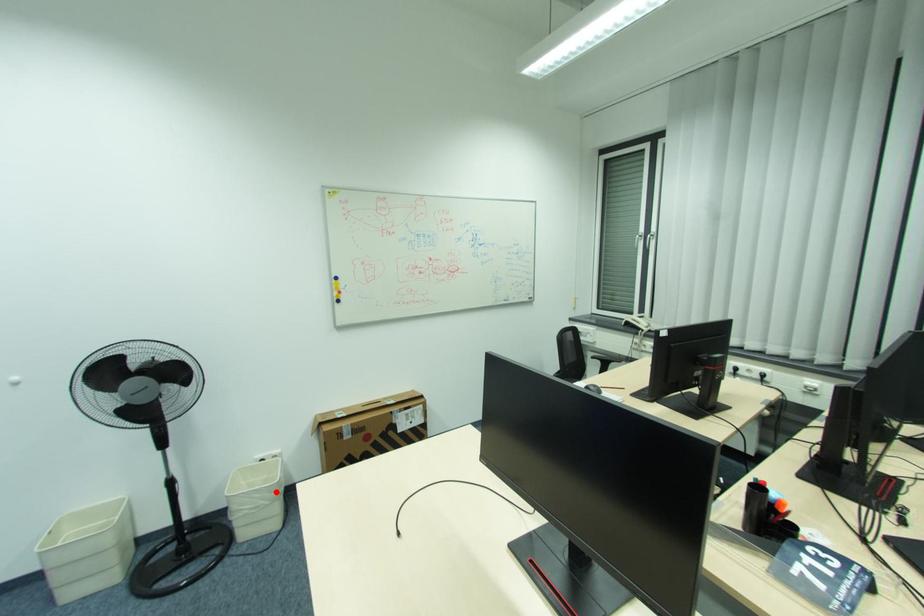
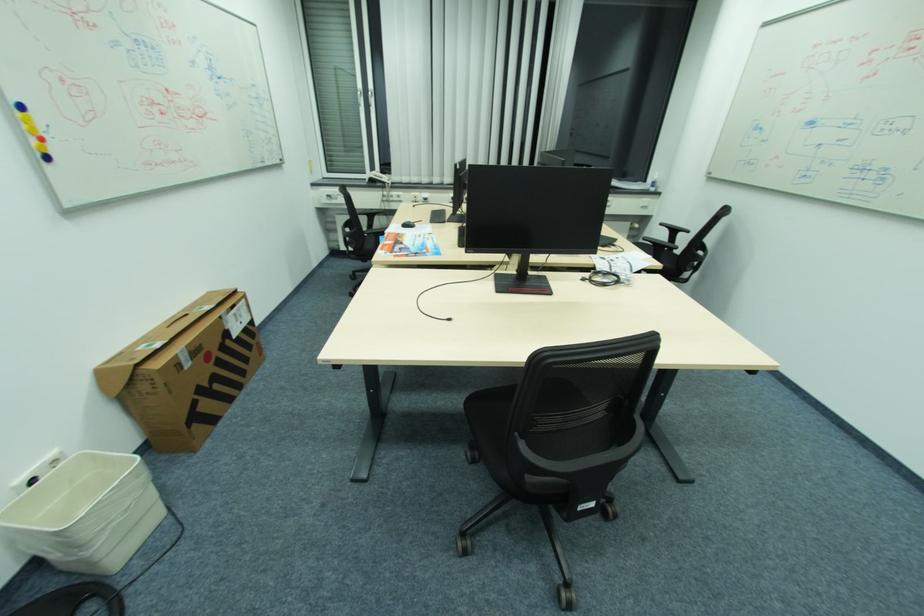
Question: I am providing you with two images of the same scene from different viewpoints. A red point is marked on the first image. At the location where the point appears in image 1, is it still visible in image 2?

Choices:
 (A) Yes
 (B) No

Answer: (A)